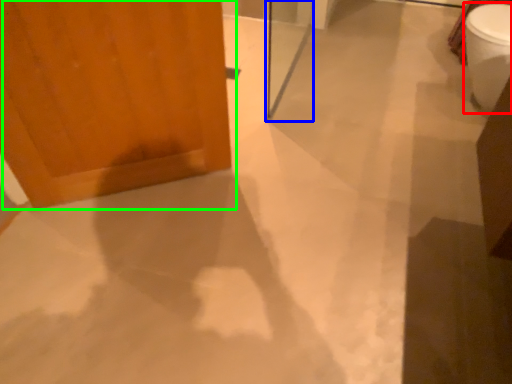
Question: Which is farther away from toilet bowl (highlighted by a red box)? screen door (highlighted by a blue box) or door (highlighted by a green box)?

Choices:
 (A) screen door
 (B) door

Answer: (B)